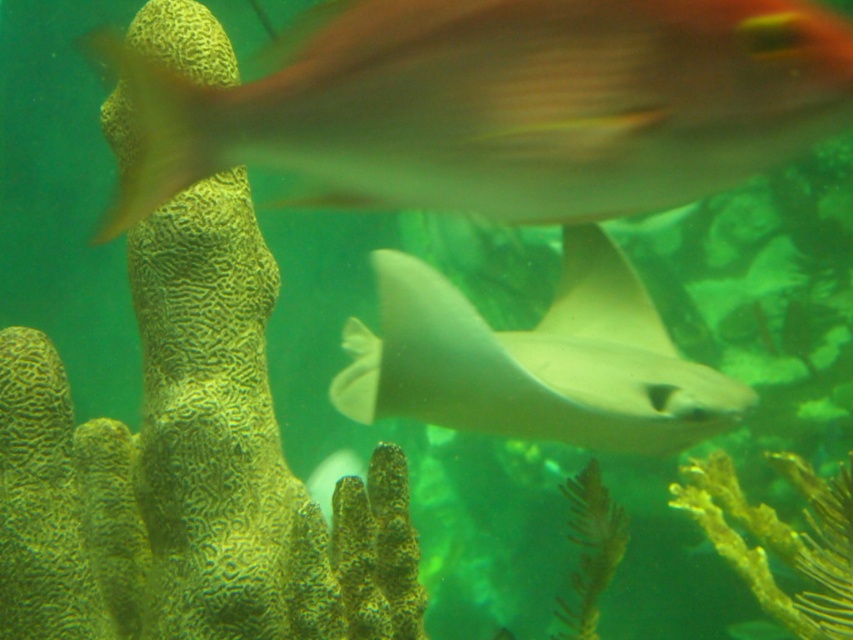
Question: Can you confirm if translucent white fish at upper center is positioned above smooth gray stingray at center?

Choices:
 (A) yes
 (B) no

Answer: (A)

Question: Does translucent white fish at upper center appear under smooth gray stingray at center?

Choices:
 (A) yes
 (B) no

Answer: (B)

Question: Which point appears closest to the camera in this image?

Choices:
 (A) (596, 378)
 (B) (241, 148)

Answer: (B)

Question: Which of the following is the closest to the observer?

Choices:
 (A) (471, 353)
 (B) (624, 3)

Answer: (B)

Question: Which point appears farthest from the camera in this image?

Choices:
 (A) coord(525,365)
 (B) coord(405,166)

Answer: (A)

Question: Is translucent white fish at upper center above smooth gray stingray at center?

Choices:
 (A) no
 (B) yes

Answer: (B)